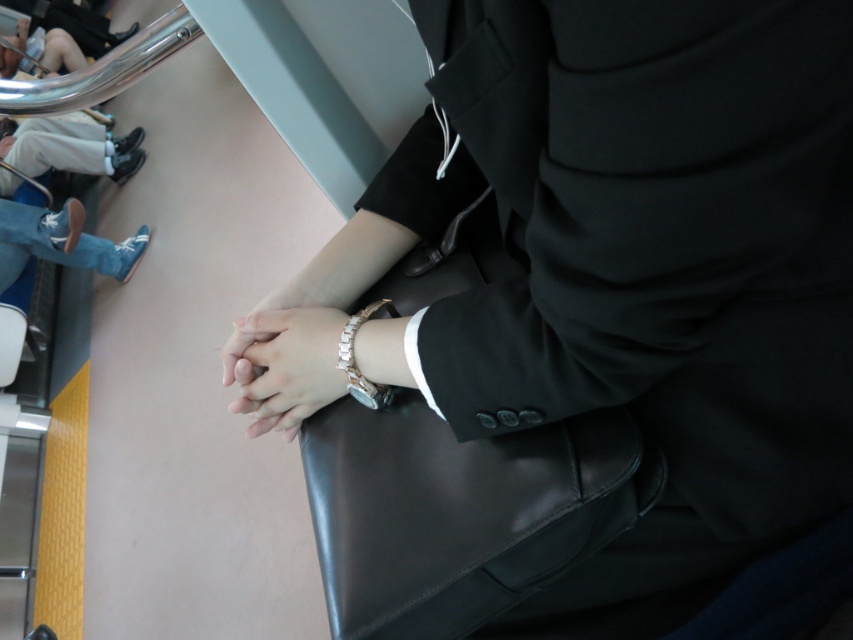
Where is the black matte suit at center located in the image?

The black matte suit at center is located at point (590, 314) in the image.

You are a fashion designer observing the scene. You need to determine the spatial relationship between the black matte suit at center and the satin silver watch at center. Which object is positioned to the right of the other?

The black matte suit at center is to the right of the satin silver watch at center.

You are a photographer taking a picture of the black matte suit at center and the satin silver watch at center. Which object will appear larger in your photo?

The black matte suit at center will appear larger in the photo because it is closer to the viewer than the satin silver watch at center.